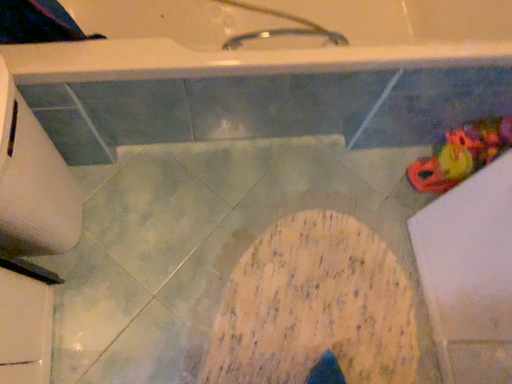
Locate an element on the screen. The width and height of the screenshot is (512, 384). spots to the right of white matte toilet paper at left is located at coordinates (145, 236).